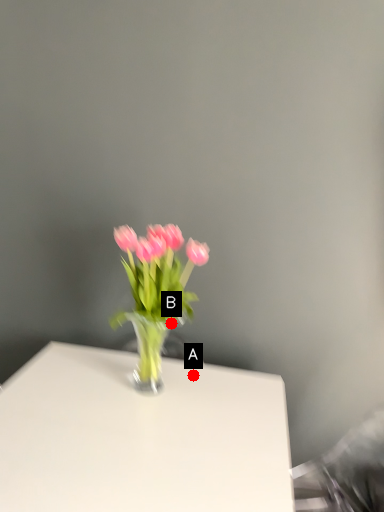
Question: Two points are circled on the image, labeled by A and B beside each circle. Which point is further to the camera?

Choices:
 (A) A is further
 (B) B is further

Answer: (A)